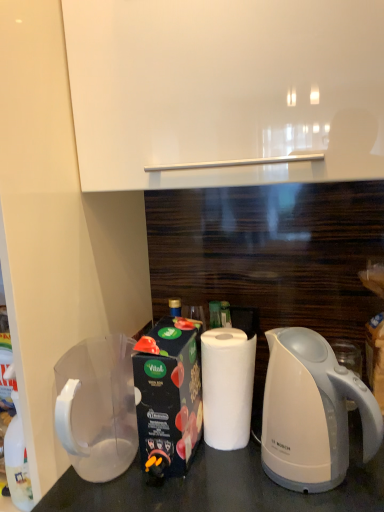
What do you see at coordinates (227, 387) in the screenshot?
I see `white matte paper towel at center` at bounding box center [227, 387].

At what (x,y) coordinates should I click in order to perform the action: click on white matte paper towel at center. Please return your answer as a coordinate pair (x, y). Looking at the image, I should click on (227, 387).

Considering the sizes of objects transparent plastic pitcher at lower left and white matte paper towel at center in the image provided, who is bigger, transparent plastic pitcher at lower left or white matte paper towel at center?

With larger size is transparent plastic pitcher at lower left.

From the image's perspective, would you say transparent plastic pitcher at lower left is shown under white matte paper towel at center?

Yes, from the image's perspective, transparent plastic pitcher at lower left is beneath white matte paper towel at center.

How much distance is there between transparent plastic pitcher at lower left and white matte paper towel at center?

transparent plastic pitcher at lower left is 9.73 inches from white matte paper towel at center.

From a real-world perspective, is transparent plastic pitcher at lower left under white matte paper towel at center?

Correct, in the physical world, transparent plastic pitcher at lower left is lower than white matte paper towel at center.

Locate an element on the screen. This screenshot has height=512, width=384. paper towel below the white glossy electric kettle at lower right (from a real-world perspective) is located at coordinates (227, 387).

Between white glossy electric kettle at lower right and white matte paper towel at center, which one is positioned behind?

white matte paper towel at center is further from the camera.

Is white glossy electric kettle at lower right far away from white matte paper towel at center?

No, white glossy electric kettle at lower right is not far away from white matte paper towel at center.

From the picture: Is white glossy electric kettle at lower right to the right of white matte paper towel at center from the viewer's perspective?

Yes, white glossy electric kettle at lower right is to the right of white matte paper towel at center.

Based on the photo, are transparent plastic pitcher at lower left and white glossy electric kettle at lower right far apart?

They are positioned close to each other.

From a real-world perspective, which object stands above the other?

white glossy electric kettle at lower right is physically above.

Consider the image. Considering the sizes of objects transparent plastic pitcher at lower left and white glossy electric kettle at lower right in the image provided, who is shorter, transparent plastic pitcher at lower left or white glossy electric kettle at lower right?

With less height is transparent plastic pitcher at lower left.

Measure the distance between white matte paper towel at center and white glossy electric kettle at lower right.

They are 5.58 inches apart.

From the picture: Is white matte paper towel at center far away from white glossy electric kettle at lower right?

No.

Considering the sizes of white matte paper towel at center and white glossy electric kettle at lower right in the image, is white matte paper towel at center wider or thinner than white glossy electric kettle at lower right?

In the image, white matte paper towel at center appears to be more narrow than white glossy electric kettle at lower right.

From the image's perspective, is white matte paper towel at center located beneath white glossy electric kettle at lower right?

No, from the image's perspective, white matte paper towel at center is not below white glossy electric kettle at lower right.

Between white glossy electric kettle at lower right and transparent plastic pitcher at lower left, which one has smaller width?

white glossy electric kettle at lower right.

Which is more to the right, white glossy electric kettle at lower right or transparent plastic pitcher at lower left?

white glossy electric kettle at lower right.

Considering the relative sizes of white glossy electric kettle at lower right and transparent plastic pitcher at lower left in the image provided, is white glossy electric kettle at lower right smaller than transparent plastic pitcher at lower left?

No, white glossy electric kettle at lower right is not smaller than transparent plastic pitcher at lower left.

Is white glossy electric kettle at lower right not near transparent plastic pitcher at lower left?

No, there isn't a large distance between white glossy electric kettle at lower right and transparent plastic pitcher at lower left.

Based on the photo, does white matte paper towel at center have a greater width compared to transparent plastic pitcher at lower left?

In fact, white matte paper towel at center might be narrower than transparent plastic pitcher at lower left.

Looking at this image, from a real-world perspective, is white matte paper towel at center below transparent plastic pitcher at lower left?

No, from a real-world perspective, white matte paper towel at center is not below transparent plastic pitcher at lower left.

Considering the positions of point (237, 344) and point (121, 418), is point (237, 344) closer or farther from the camera than point (121, 418)?

Clearly, point (237, 344) is closer to the camera than point (121, 418).

I want to click on pitcher located on the left of white matte paper towel at center, so click(x=97, y=407).

The height and width of the screenshot is (512, 384). In order to click on paper towel lying above the transparent plastic pitcher at lower left (from the image's perspective) in this screenshot , I will do `click(227, 387)`.

Where is `kettle on the right of white matte paper towel at center`? The height and width of the screenshot is (512, 384). kettle on the right of white matte paper towel at center is located at coordinates (311, 413).

Looking at the image, which one is located further to white glossy electric kettle at lower right, white matte paper towel at center or transparent plastic pitcher at lower left?

transparent plastic pitcher at lower left is positioned further to the anchor white glossy electric kettle at lower right.

Looking at this image, considering their positions, is white matte paper towel at center positioned further to transparent plastic pitcher at lower left than white glossy electric kettle at lower right?

white glossy electric kettle at lower right is positioned further to the anchor transparent plastic pitcher at lower left.

Based on their spatial positions, is white glossy electric kettle at lower right or transparent plastic pitcher at lower left closer to white matte paper towel at center?

white glossy electric kettle at lower right lies closer to white matte paper towel at center than the other object.

Looking at the image, which one is located further to white matte paper towel at center, transparent plastic pitcher at lower left or white glossy electric kettle at lower right?

transparent plastic pitcher at lower left.

From the image, which object appears to be farther from transparent plastic pitcher at lower left, white glossy electric kettle at lower right or white matte paper towel at center?

Based on the image, white glossy electric kettle at lower right appears to be further to transparent plastic pitcher at lower left.

Estimate the real-world distances between objects in this image. Which object is further from white glossy electric kettle at lower right, transparent plastic pitcher at lower left or white matte paper towel at center?

transparent plastic pitcher at lower left is further to white glossy electric kettle at lower right.

I want to click on paper towel situated between transparent plastic pitcher at lower left and white glossy electric kettle at lower right from left to right, so click(227, 387).